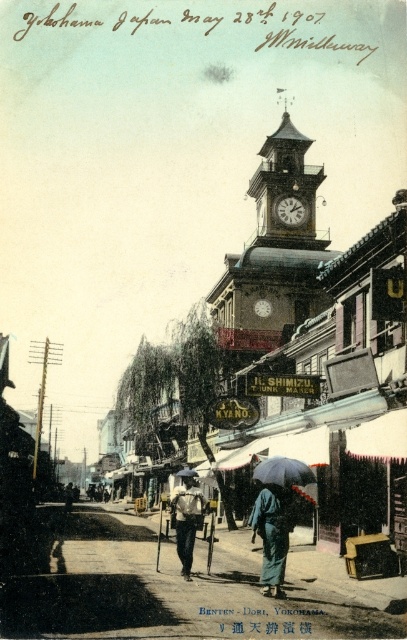
Question: Which object is farther from the camera taking this photo?

Choices:
 (A) green fabric kimono at center
 (B) white clock face at center
 (C) dark brown wooden clock at center

Answer: (C)

Question: In this image, where is light brown fabric pants at center located relative to black matte umbrella at center?

Choices:
 (A) right
 (B) left

Answer: (B)

Question: Where is gold metallic clock tower at center located in relation to white clock face at center in the image?

Choices:
 (A) above
 (B) below

Answer: (A)

Question: Which object appears closest to the camera in this image?

Choices:
 (A) black matte umbrella at center
 (B) white clock face at center
 (C) green fabric kimono at center
 (D) light brown fabric pants at center

Answer: (C)

Question: Does black matte umbrella at center appear on the left side of dark brown wooden clock at center?

Choices:
 (A) yes
 (B) no

Answer: (A)

Question: Among these objects, which one is farthest from the camera?

Choices:
 (A) gold metallic clock tower at center
 (B) white clock face at center

Answer: (A)